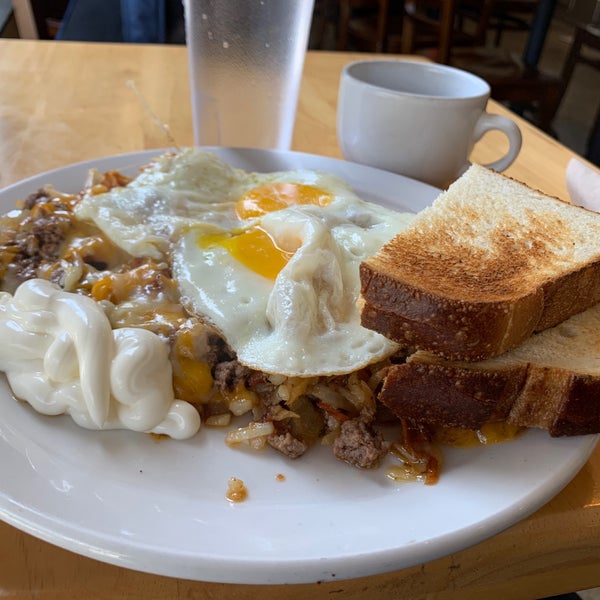
I want to click on water glass, so click(225, 81).